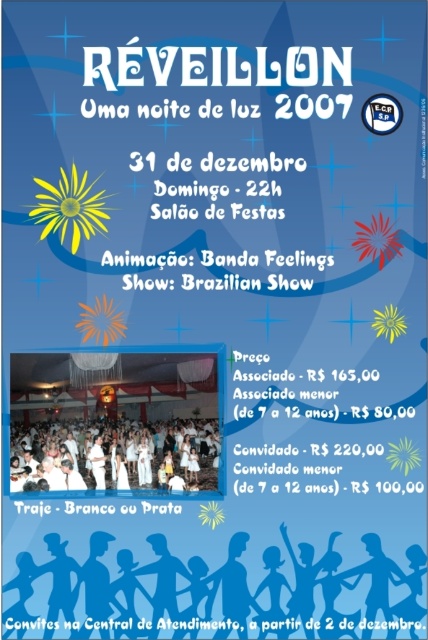
Between silhouette paper people at lower center and white cloth dress at center, which one is positioned higher?

white cloth dress at center

Is point (178, 566) behind point (91, 484)?

No, (178, 566) is closer to viewer.

Identify the location of silhouette paper people at lower center. (214, 592).